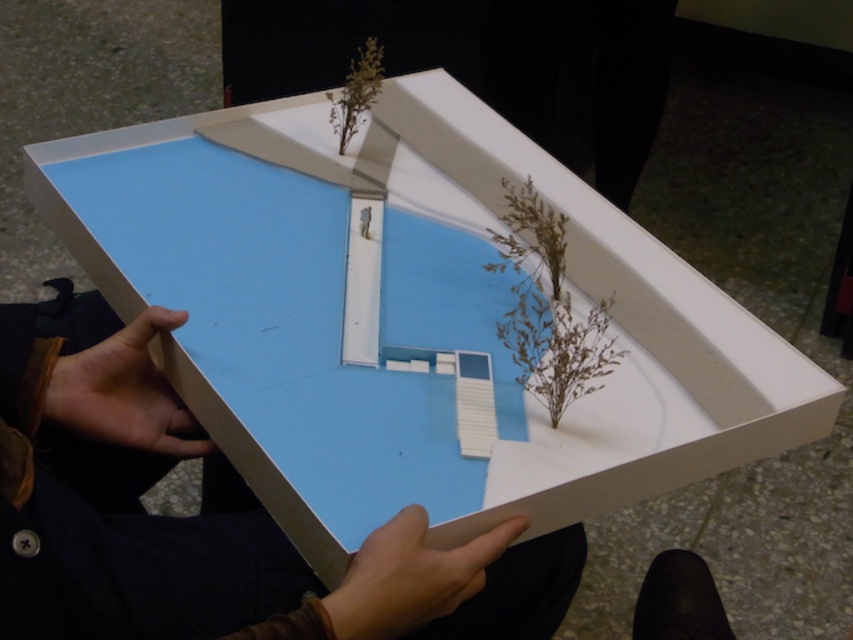
Image resolution: width=853 pixels, height=640 pixels. Describe the element at coordinates (125, 394) in the screenshot. I see `matte skin hand at lower left` at that location.

Who is more forward, [68,392] or [404,556]?

Point [404,556]

Where is `matte skin hand at lower left`? matte skin hand at lower left is located at coordinates (125, 394).

Does matte white model house at center have a lesser height compared to matte black hand at lower center?

No, matte white model house at center is not shorter than matte black hand at lower center.

Does point (28, 556) come farther from viewer compared to point (393, 516)?

No, it is in front of (393, 516).

What do you see at coordinates (206, 516) in the screenshot?
I see `matte white model house at center` at bounding box center [206, 516].

The height and width of the screenshot is (640, 853). Find the location of `matte white model house at center`. matte white model house at center is located at coordinates (206, 516).

Is point (120, 620) positioned in front of point (55, 394)?

That is True.

Who is more forward, (376, 570) or (126, 339)?

Positioned in front is point (376, 570).

The width and height of the screenshot is (853, 640). Find the location of `matte white model house at center`. matte white model house at center is located at coordinates (206, 516).